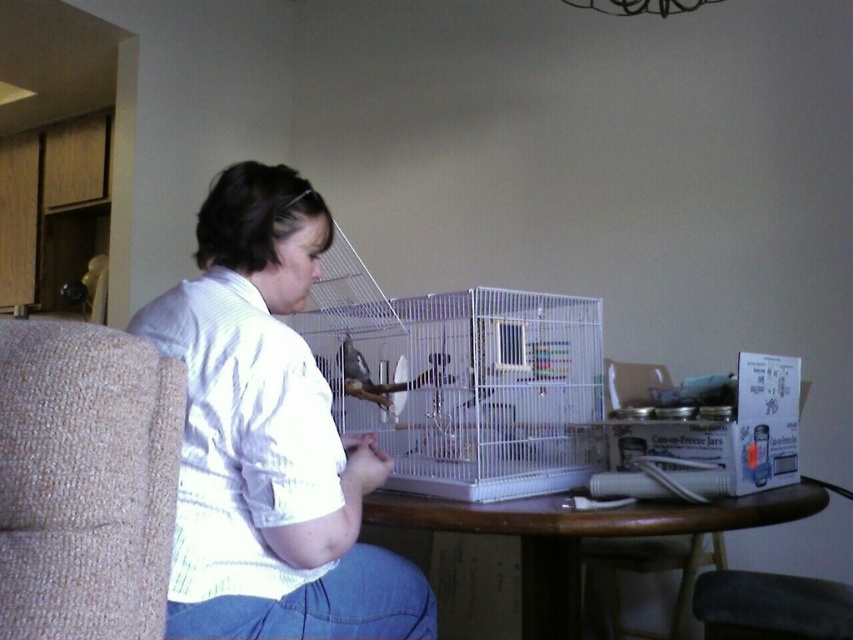
Is wooden table at center bigger than velvet-like dark brown chair at lower right?

Yes, wooden table at center is bigger than velvet-like dark brown chair at lower right.

Who is positioned more to the left, wooden table at center or velvet-like dark brown chair at lower right?

Positioned to the left is wooden table at center.

Which is in front, point (525, 582) or point (718, 628)?

Point (525, 582) is more forward.

The height and width of the screenshot is (640, 853). I want to click on wooden table at center, so click(x=578, y=536).

In the scene shown: Does clear plastic chair at lower right come behind matte white bird at center?

Yes, it is behind matte white bird at center.

Can you confirm if clear plastic chair at lower right is positioned below matte white bird at center?

Yes.

Between point (701, 557) and point (349, 340), which one is positioned in front?

Point (349, 340)

I want to click on clear plastic chair at lower right, so click(653, 572).

Is point (421, 308) positioned before point (525, 513)?

No, (421, 308) is further to viewer.

Can you confirm if white wire bird cage at center is positioned to the left of wooden table at center?

Yes, white wire bird cage at center is to the left of wooden table at center.

Who is more forward, (575, 355) or (363, 509)?

Positioned in front is point (363, 509).

This screenshot has width=853, height=640. I want to click on white wire bird cage at center, so click(x=461, y=381).